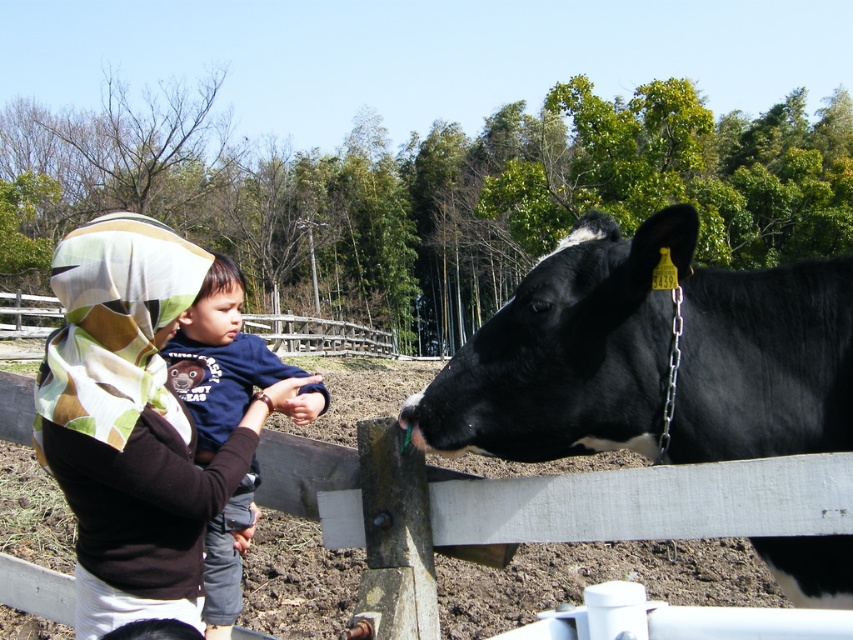
Which is above, brown textured scarf at upper left or dark blue cotton shirt at center?

brown textured scarf at upper left is higher up.

Consider the image. Who is taller, brown textured scarf at upper left or dark blue cotton shirt at center?

dark blue cotton shirt at center

Identify the location of brown textured scarf at upper left. This screenshot has height=640, width=853. (131, 422).

Does black glossy cow at right appear under dark blue cotton shirt at center?

Incorrect, black glossy cow at right is not positioned below dark blue cotton shirt at center.

Is point (590, 381) positioned behind point (215, 387)?

No.

Where is `black glossy cow at right`? This screenshot has height=640, width=853. black glossy cow at right is located at coordinates (648, 356).

Is black glossy cow at right below brown textured scarf at upper left?

Incorrect, black glossy cow at right is not positioned below brown textured scarf at upper left.

Which is below, black glossy cow at right or brown textured scarf at upper left?

brown textured scarf at upper left is lower down.

Does point (485, 380) come in front of point (148, 220)?

No, (485, 380) is behind (148, 220).

At what (x,y) coordinates should I click in order to perform the action: click on black glossy cow at right. Please return your answer as a coordinate pair (x, y). Looking at the image, I should click on (648, 356).